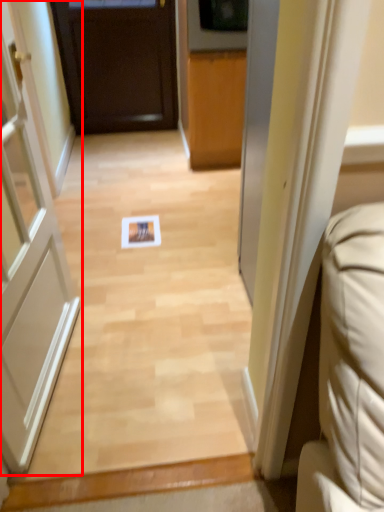
Question: From the image's perspective, where is door (annotated by the red box) located in relation to door in the image?

Choices:
 (A) above
 (B) below

Answer: (B)